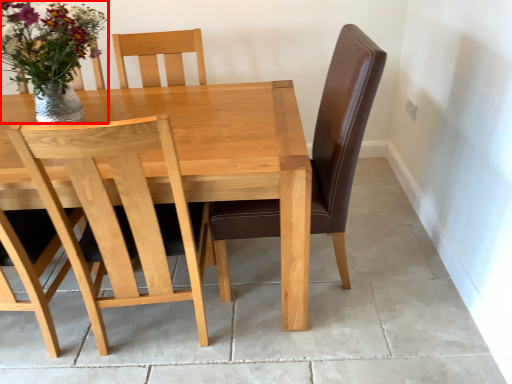
Question: Considering the relative positions of floral arrangement (annotated by the red box) and chair in the image provided, where is floral arrangement (annotated by the red box) located with respect to the staircase?

Choices:
 (A) left
 (B) right

Answer: (A)